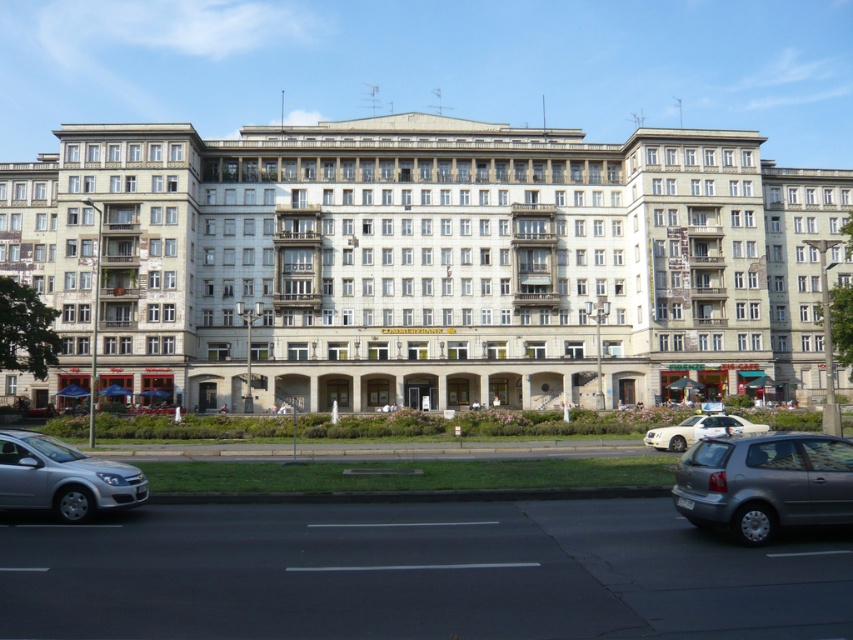
Is point (805, 304) positioned after point (82, 483)?

That is True.

Who is more distant from viewer, (245,364) or (85,492)?

The point (245,364) is behind.

The image size is (853, 640). What are the coordinates of `white concrete building at center` in the screenshot? It's located at (422, 260).

Is white concrete building at center further to camera compared to silver metallic hatchback at lower right?

Yes, it is behind silver metallic hatchback at lower right.

Between white concrete building at center and silver metallic hatchback at lower right, which one has less height?

Standing shorter between the two is silver metallic hatchback at lower right.

Is point (798, 232) positioned behind point (775, 445)?

Yes, point (798, 232) is farther from viewer.

What are the coordinates of `white concrete building at center` in the screenshot? It's located at (422, 260).

Is silver metallic hatchback at lower right smaller than white glossy sedan at center?

Yes, silver metallic hatchback at lower right is smaller than white glossy sedan at center.

Looking at this image, who is higher up, silver metallic hatchback at lower right or white glossy sedan at center?

silver metallic hatchback at lower right

Find the location of a particular element. This screenshot has width=853, height=640. silver metallic hatchback at lower right is located at coordinates (764, 483).

Where is `silver metallic hatchback at lower right`? silver metallic hatchback at lower right is located at coordinates (764, 483).